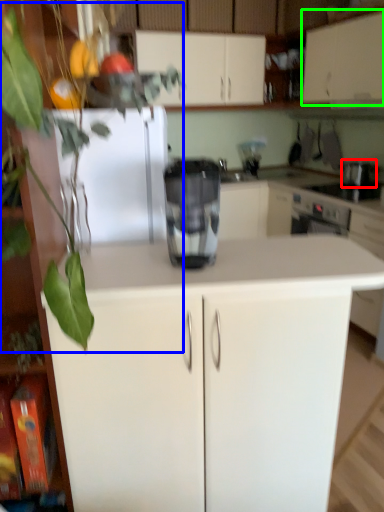
Question: Considering the real-world distances, which object is farthest from appliance (highlighted by a red box)? plant (highlighted by a blue box) or cabinetry (highlighted by a green box)?

Choices:
 (A) plant
 (B) cabinetry

Answer: (A)